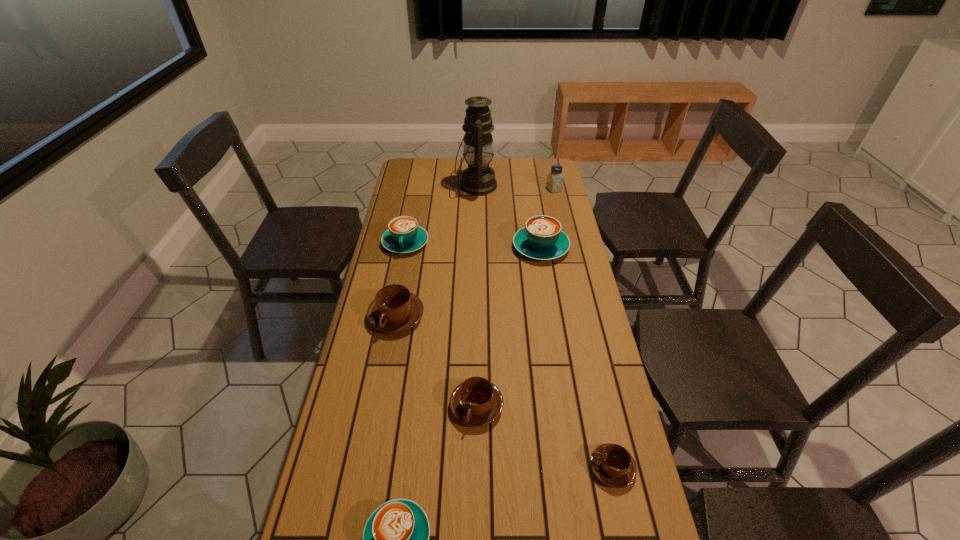
Find the location of a particular element. the tallest object is located at coordinates pos(478,179).

Where is `saltshaker`? saltshaker is located at coordinates (555, 179).

Where is `the rightmost turquoise cappuccino`? This screenshot has width=960, height=540. the rightmost turquoise cappuccino is located at coordinates (542, 239).

I want to click on the leftmost brown cappuccino, so click(394, 309).

At what (x,y) coordinates should I click in order to perform the action: click on the farthest brown cappuccino. Please return your answer as a coordinate pair (x, y). The width and height of the screenshot is (960, 540). Looking at the image, I should click on (394, 309).

Locate an element on the screen. Image resolution: width=960 pixels, height=540 pixels. the second smallest turquoise cappuccino is located at coordinates (404, 235).

Find the location of a particular element. the sixth farthest object is located at coordinates (476, 402).

Image resolution: width=960 pixels, height=540 pixels. In order to click on the second nearest brown cappuccino in this screenshot , I will do `click(476, 402)`.

This screenshot has width=960, height=540. I want to click on the shortest object, so [613, 465].

This screenshot has width=960, height=540. I want to click on the smallest brown cappuccino, so click(x=613, y=465).